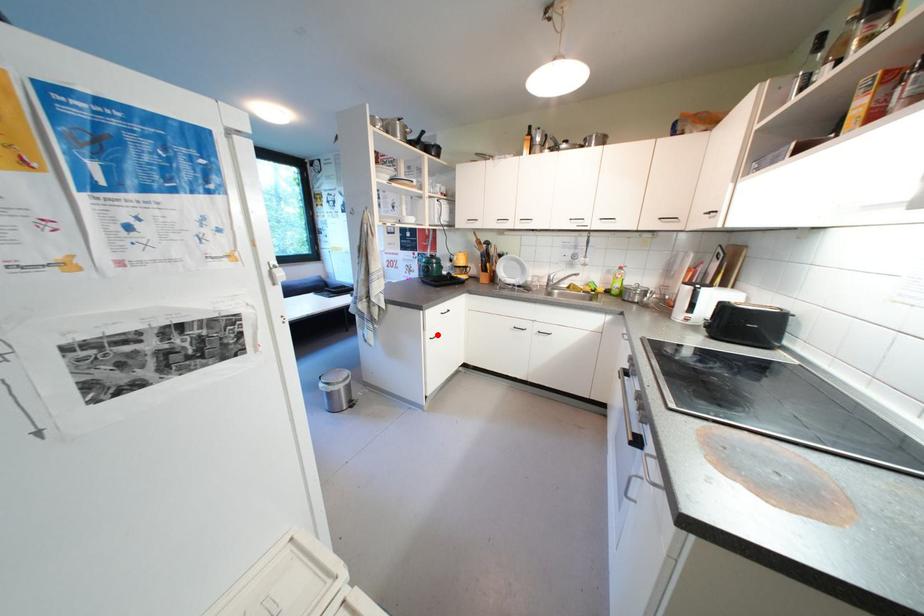
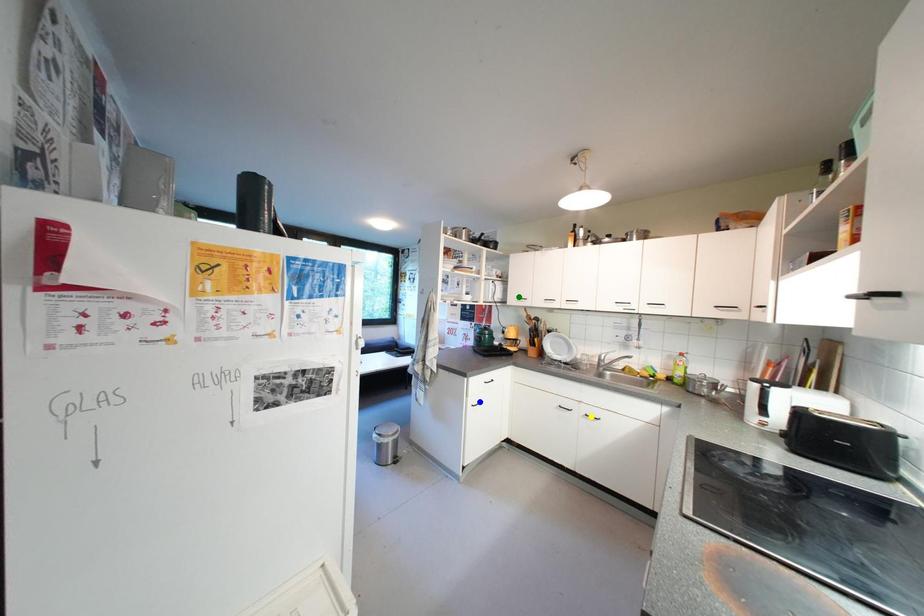
Question: I am providing you with two images of the same scene from different viewpoints. A red point is marked on the first image. You are given multiple points on the second image. Which spot in image 2 lines up with the point in image 1?

Choices:
 (A) yellow point
 (B) green point
 (C) blue point

Answer: (C)